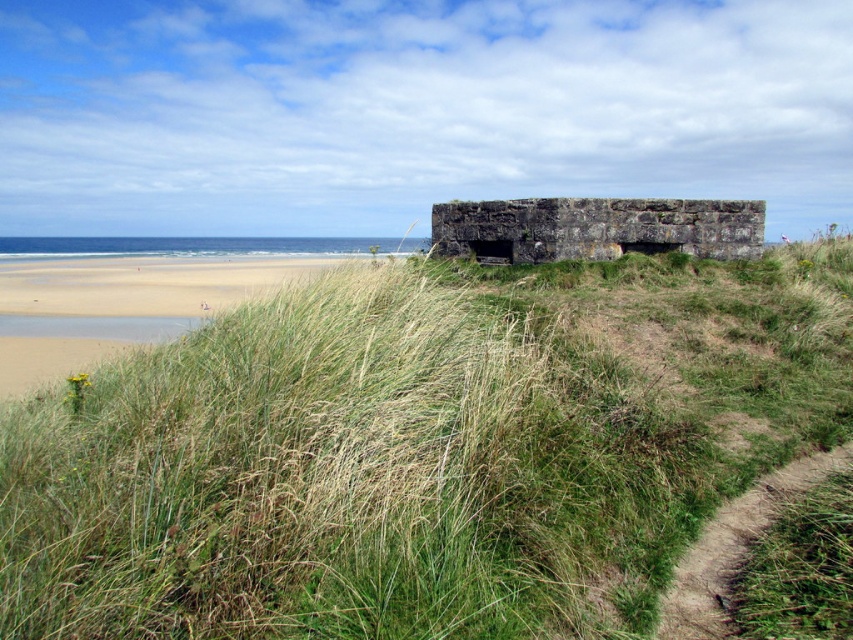
You are a hiker who wants to cross the area between the green grassy at center and the sandy beige sand at lower left. Which surface is lower in height?

The green grassy at center is shorter than the sandy beige sand at lower left, so the green grassy at center is lower in height.

You are standing at the edge of the sandy beige sand at lower left and want to reach the stone structure. Which direction should you walk to avoid the green grassy at center?

To avoid the green grassy at center, you should walk to the left since the green grassy at center is to the right of the sandy beige sand at lower left, meaning the left direction leads away from the grass towards the stone structure.

You are standing on the beach looking at the stone structure. There are two points marked on the image. Which point, point (523, 620) or point (120, 308), is closer to you?

Point (523, 620) is closer to the viewer than point (120, 308).